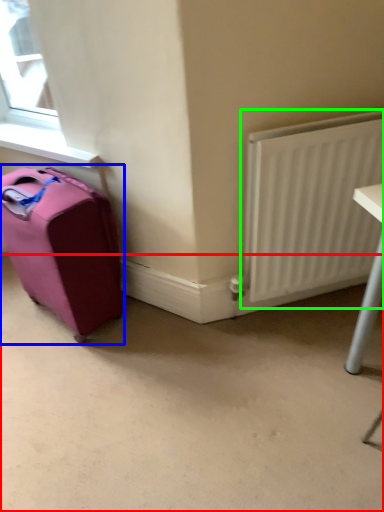
Question: Which object is positioned farthest from concrete (highlighted by a red box)? Select from luggage and bags (highlighted by a blue box) and radiator (highlighted by a green box).

Choices:
 (A) luggage and bags
 (B) radiator

Answer: (B)